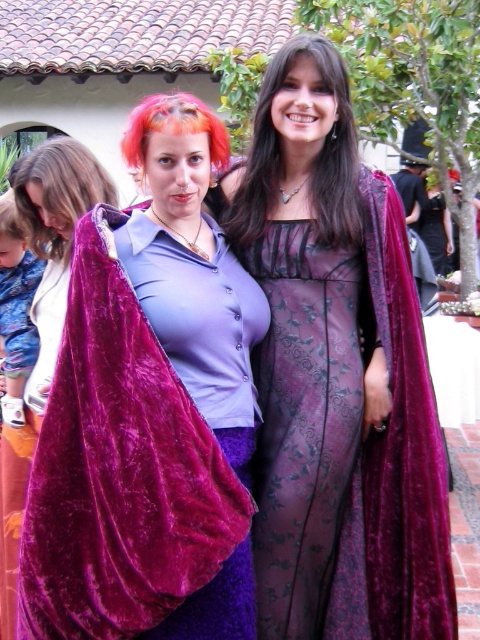
Question: Estimate the real-world distances between objects in this image. Which object is farther from the velvet cape at center?

Choices:
 (A) velvet purple dress at center
 (B) dark brown silky hair at center

Answer: (B)

Question: Can you confirm if blonde hair at left is thinner than brown matte hair at center?

Choices:
 (A) yes
 (B) no

Answer: (B)

Question: Which point appears closest to the camera in this image?

Choices:
 (A) (222, 157)
 (B) (14, 228)

Answer: (A)

Question: Based on their relative distances, which object is farther from the velvet cape at center?

Choices:
 (A) dark brown silky hair at center
 (B) brown matte hair at center

Answer: (B)

Question: Does velvet purple dress at center have a smaller size compared to brown matte hair at center?

Choices:
 (A) yes
 (B) no

Answer: (B)

Question: Is velvet cape at left thinner than orange dyed hair at center?

Choices:
 (A) yes
 (B) no

Answer: (A)